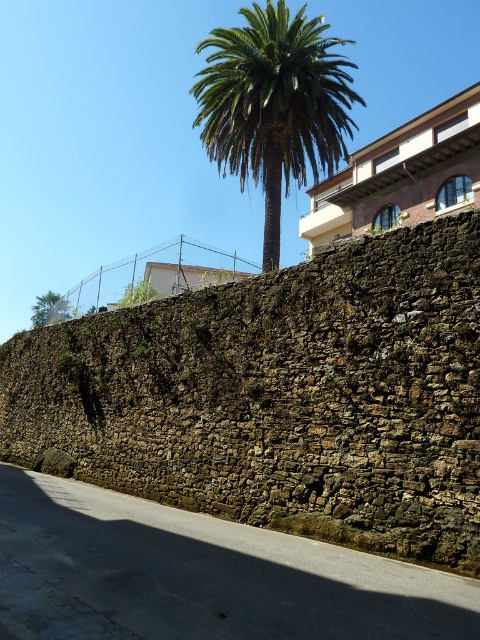
From the picture: You are a bird flying over the urban scene. You want to land on the closest tree to your current position. Which tree should you choose between the green leafy palm at upper left and the green leafy tree at upper center?

The green leafy palm at upper left is closer to your current position because the green leafy tree at upper center is behind it, indicating it is farther away.